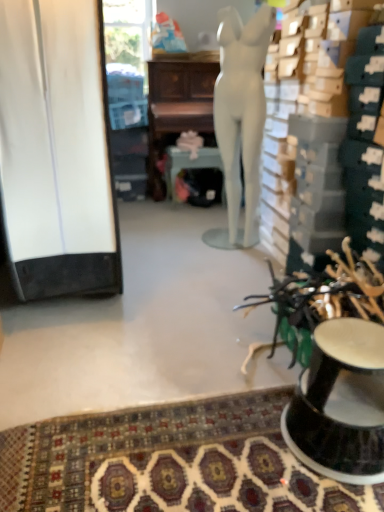
Question: Is matte silver round table at center looking in the opposite direction of white matte mannequin at center?

Choices:
 (A) no
 (B) yes

Answer: (B)

Question: Is matte silver round table at center to the left of white matte mannequin at center from the viewer's perspective?

Choices:
 (A) yes
 (B) no

Answer: (A)

Question: Is matte silver round table at center bigger than white matte mannequin at center?

Choices:
 (A) yes
 (B) no

Answer: (B)

Question: Considering the relative sizes of matte silver round table at center and white matte mannequin at center in the image provided, is matte silver round table at center wider than white matte mannequin at center?

Choices:
 (A) yes
 (B) no

Answer: (A)

Question: Is matte silver round table at center directly adjacent to white matte mannequin at center?

Choices:
 (A) no
 (B) yes

Answer: (A)

Question: From a real-world perspective, is matte silver round table at center positioned over white matte mannequin at center based on gravity?

Choices:
 (A) no
 (B) yes

Answer: (A)

Question: Is patterned carpet at lower center looking in the opposite direction of white matte mannequin at center?

Choices:
 (A) yes
 (B) no

Answer: (B)

Question: Is white matte mannequin at center located within patterned carpet at lower center?

Choices:
 (A) yes
 (B) no

Answer: (B)

Question: From a real-world perspective, does patterned carpet at lower center stand above white matte mannequin at center?

Choices:
 (A) yes
 (B) no

Answer: (B)

Question: Does patterned carpet at lower center have a smaller size compared to white matte mannequin at center?

Choices:
 (A) yes
 (B) no

Answer: (A)

Question: Can you confirm if patterned carpet at lower center is bigger than white matte mannequin at center?

Choices:
 (A) yes
 (B) no

Answer: (B)

Question: Is patterned carpet at lower center at the left side of white matte mannequin at center?

Choices:
 (A) yes
 (B) no

Answer: (A)

Question: Would you say white matte cabinet at left is outside wooden desk at center?

Choices:
 (A) yes
 (B) no

Answer: (A)